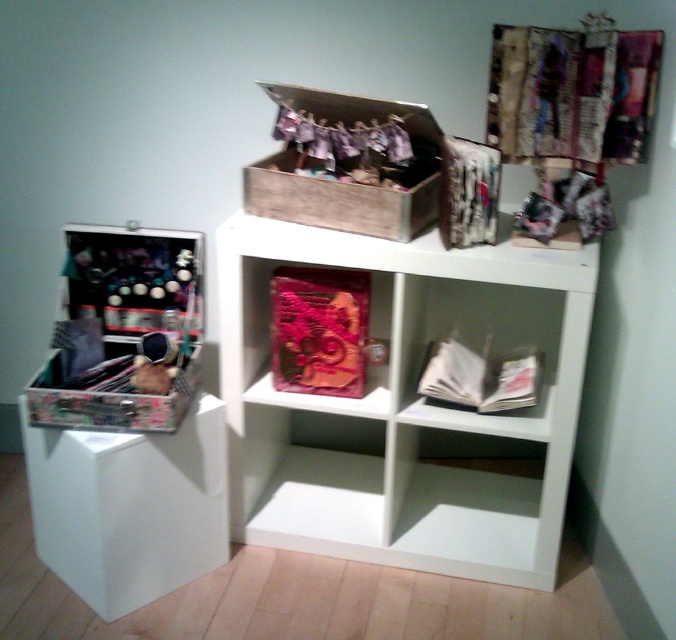
Is point (126, 484) positioned before point (416, 193)?

Yes, point (126, 484) is in front of point (416, 193).

Who is more forward, (24, 445) or (338, 205)?

Point (338, 205) is in front.

Measure the distance between point (87, 500) and camera.

Point (87, 500) and camera are 5.11 feet apart from each other.

You are a GUI agent. You are given a task and a screenshot of the screen. Output one action in this format:
    pyautogui.click(x=<x>, y=<y>)
    Task: Click on the clear plastic drawer at left
    
    Given the screenshot: What is the action you would take?
    click(x=128, y=506)

Can you confirm if white matte bookshelf at center is positioned below clear plastic drawer at left?

Incorrect, white matte bookshelf at center is not positioned below clear plastic drawer at left.

Which of these two, white matte bookshelf at center or clear plastic drawer at left, stands shorter?

clear plastic drawer at left is shorter.

Is point (479, 314) positioned behind point (220, 531)?

Yes, point (479, 314) is farther from viewer.

Find the location of a particular element. The image size is (676, 640). white matte bookshelf at center is located at coordinates (404, 404).

Which of these two, white matte bookshelf at center or pink fabric box at center, stands shorter?

pink fabric box at center is shorter.

Is white matte bookshelf at center smaller than pink fabric box at center?

No, white matte bookshelf at center is not smaller than pink fabric box at center.

I want to click on white matte bookshelf at center, so click(x=404, y=404).

Locate an element on the screen. white matte bookshelf at center is located at coordinates (404, 404).